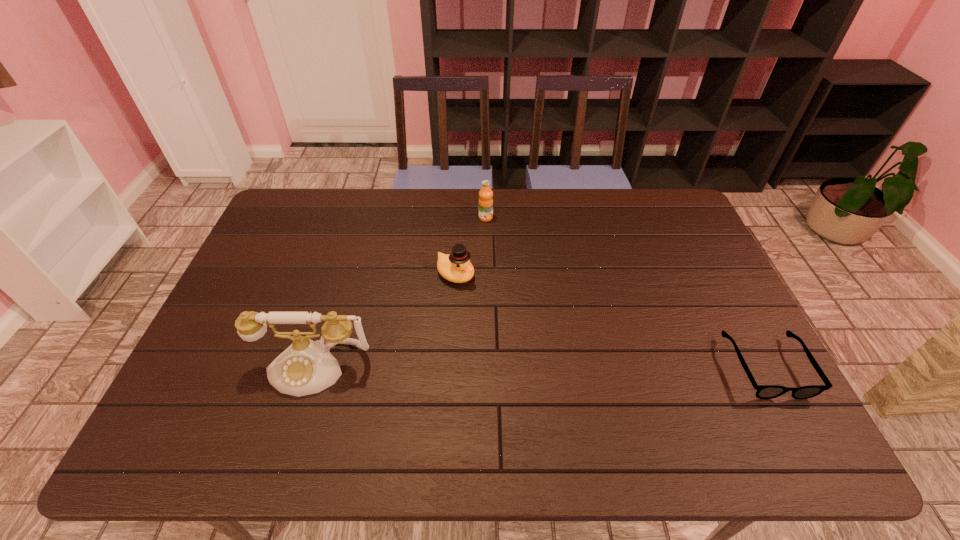
Locate an element on the screen. vacant space in between the telephone and the third object from right to left is located at coordinates (385, 321).

Find the location of a particular element. This screenshot has height=540, width=960. free point between the second shortest object and the leftmost object is located at coordinates (385, 321).

You are a GUI agent. You are given a task and a screenshot of the screen. Output one action in this format:
    pyautogui.click(x=<x>, y=<y>)
    Task: Click on the vacant point located between the telephone and the duck
    
    Given the screenshot: What is the action you would take?
    pyautogui.click(x=385, y=321)

The height and width of the screenshot is (540, 960). I want to click on free space that is in between the third object from left to right and the telephone, so click(400, 292).

Locate an element on the screen. This screenshot has width=960, height=540. vacant space in between the second shortest object and the tallest object is located at coordinates (385, 321).

Image resolution: width=960 pixels, height=540 pixels. What are the coordinates of `empty space that is in between the farthest object and the spectacles` in the screenshot? It's located at (626, 292).

Identify the location of free spot between the duck and the farthest object. (470, 246).

I want to click on object that stands as the second closest to the second object from right to left, so click(x=306, y=367).

Select which object appears as the second closest to the leftmost object. Please provide its 2D coordinates. Your answer should be formatted as a tuple, i.e. [(x, y)], where the tuple contains the x and y coordinates of a point satisfying the conditions above.

[(485, 201)]